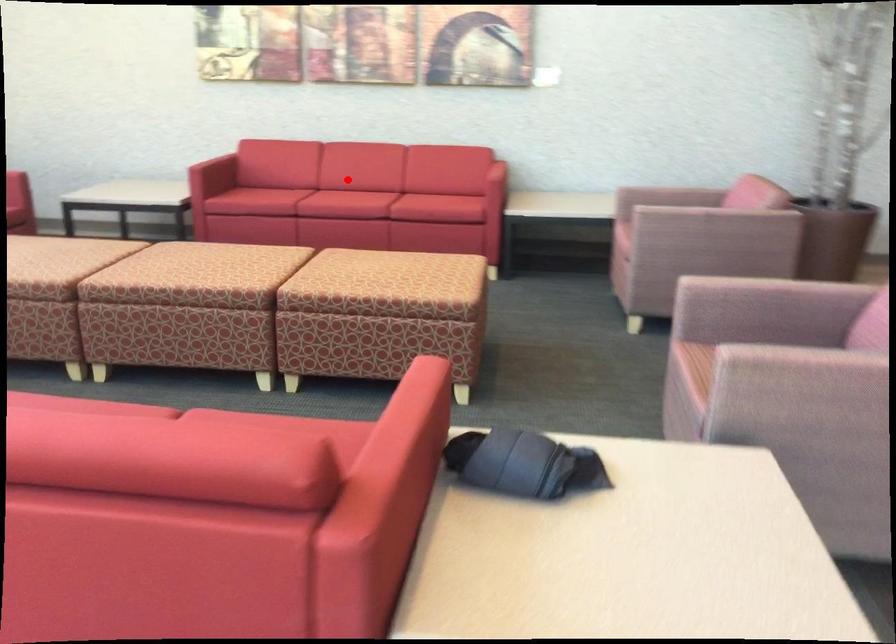
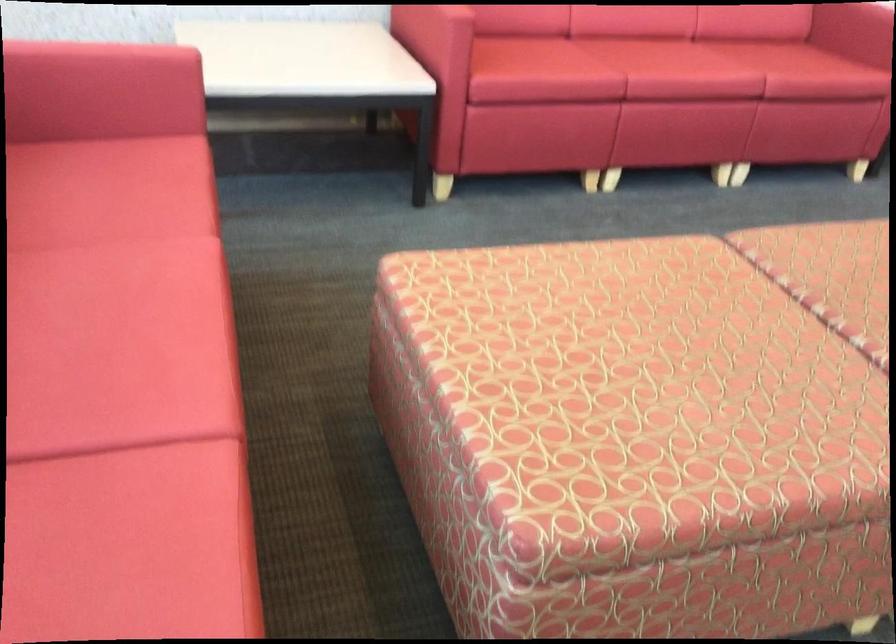
Question: I am providing you with two images of the same scene from different viewpoints. Given a red point in image1, look at the same physical point in image2. Is it:

Choices:
 (A) Closer to the viewpoint
 (B) Farther from the viewpoint

Answer: (A)